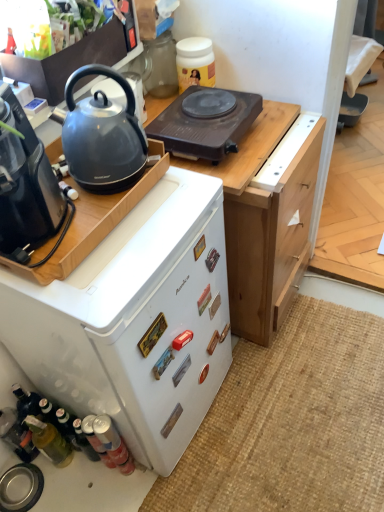
Identify the location of free area below burlap mat at lower right (from a real-world perspective). This screenshot has width=384, height=512. (304, 413).